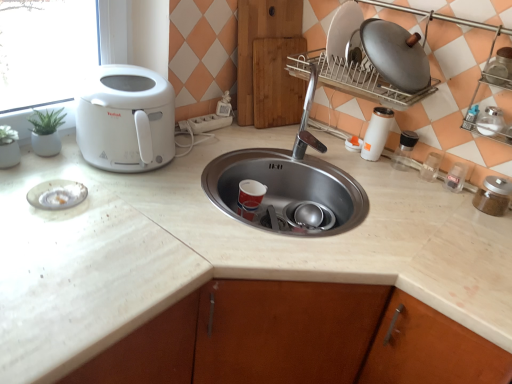
Image resolution: width=512 pixels, height=384 pixels. In order to click on vacant space to the left of transparent plastic container at right, the fourth appliance in the left-to-right sequence in this screenshot , I will do `click(375, 169)`.